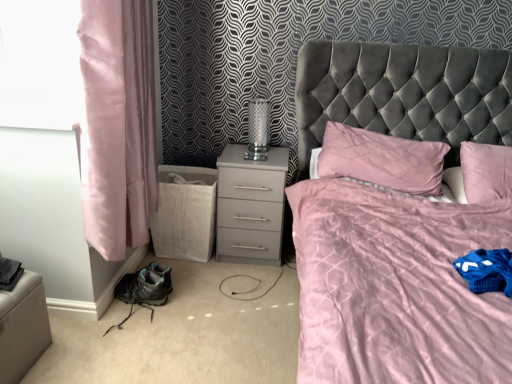
You are a GUI agent. You are given a task and a screenshot of the screen. Output one action in this format:
    pyautogui.click(x=<x>, y=<y>)
    Task: Click on the free space in front of matte gray nightstand at center
    The image size is (512, 384).
    Given the screenshot: What is the action you would take?
    pyautogui.click(x=242, y=286)